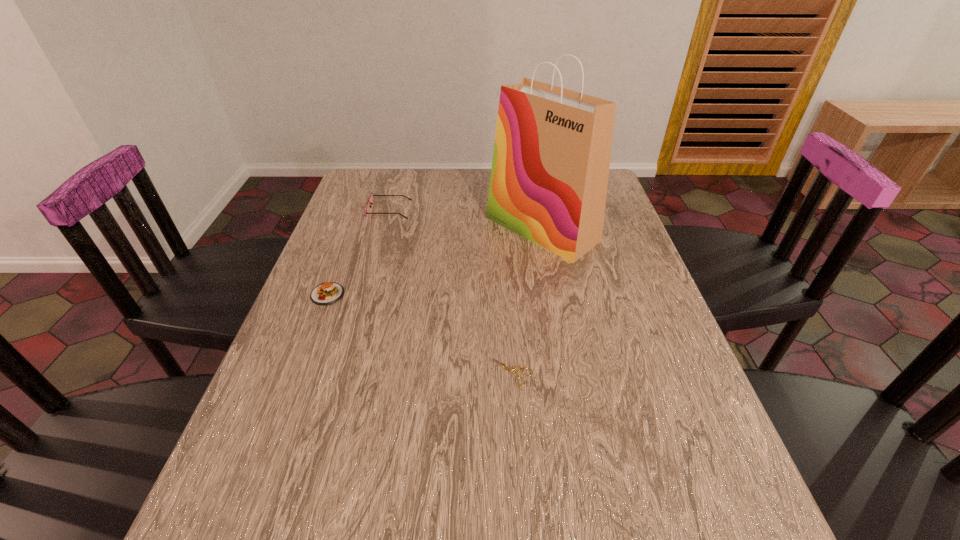
This screenshot has height=540, width=960. In order to click on vacant space that's between the third farthest object and the sunglasses in this screenshot , I will do `click(358, 252)`.

Identify the location of object that stands as the closest to the second shortest object. Image resolution: width=960 pixels, height=540 pixels. (370, 200).

Where is `object that stands as the third closest to the tallest object`? The height and width of the screenshot is (540, 960). object that stands as the third closest to the tallest object is located at coordinates (327, 293).

What are the coordinates of `free location that satisfies the following two spatial constraints: 1. on the back side of the patty (food); 2. on the right side of the tallest object` in the screenshot? It's located at (352, 229).

The width and height of the screenshot is (960, 540). I want to click on vacant position in the image that satisfies the following two spatial constraints: 1. on the bridge of the tallest object; 2. on the left side of the second tallest object, so click(x=384, y=229).

This screenshot has height=540, width=960. What are the coordinates of `blank area in the image that satisfies the following two spatial constraints: 1. on the bridge of the sunglasses; 2. on the back side of the shears` in the screenshot? It's located at (x=343, y=372).

Identify the location of free region that satisfies the following two spatial constraints: 1. on the bridge of the sunglasses; 2. on the right side of the tallest object. The image size is (960, 540). (384, 229).

Locate an element on the screen. The width and height of the screenshot is (960, 540). free space that satisfies the following two spatial constraints: 1. on the bridge of the tallest object; 2. on the right side of the second tallest object is located at coordinates (384, 229).

I want to click on free spot that satisfies the following two spatial constraints: 1. on the bridge of the sunglasses; 2. on the right side of the tallest object, so click(384, 229).

Locate an element on the screen. This screenshot has width=960, height=540. free point that satisfies the following two spatial constraints: 1. on the back side of the tallest object; 2. on the bridge of the sunglasses is located at coordinates (539, 210).